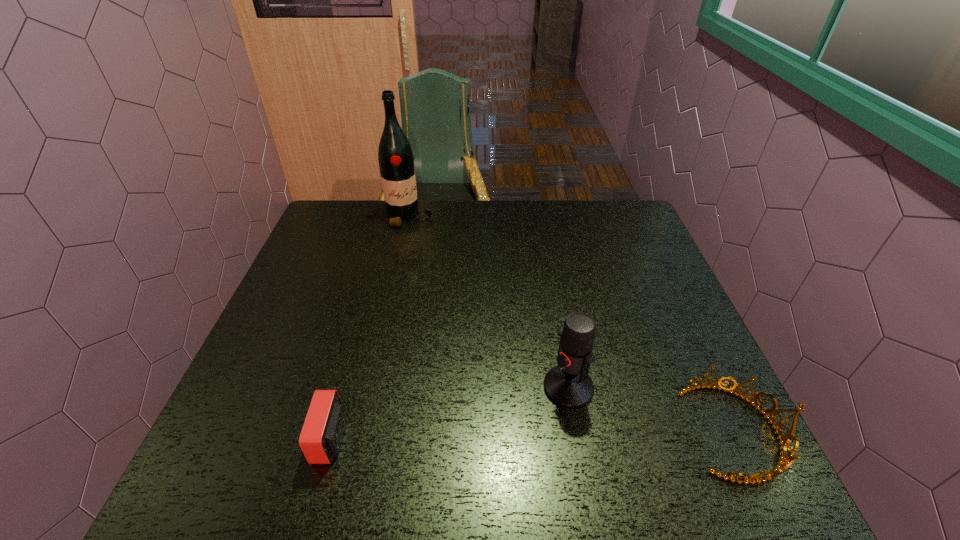
Identify the location of alarm clock. The image size is (960, 540). (321, 437).

Identify the location of the rightmost object. (784, 441).

Find the location of a particular element. The width and height of the screenshot is (960, 540). the tallest object is located at coordinates (395, 156).

Where is `wine bottle`? This screenshot has width=960, height=540. wine bottle is located at coordinates (395, 156).

Locate an element on the screen. This screenshot has width=960, height=540. microphone is located at coordinates (568, 385).

Locate an element on the screen. the third object from left to right is located at coordinates (568, 385).

You are a GUI agent. You are given a task and a screenshot of the screen. Output one action in this format:
    pyautogui.click(x=<x>, y=<y>)
    Task: Click on the vacant space situated on the front-facing side of the alarm clock
    The width and height of the screenshot is (960, 540).
    Given the screenshot: What is the action you would take?
    pyautogui.click(x=286, y=439)

What are the coordinates of `free space located 0.150m on the front-facing side of the alarm clock` in the screenshot? It's located at (240, 439).

In order to click on free space located 0.060m on the front-facing side of the alarm clock in this screenshot , I will do `click(286, 439)`.

Image resolution: width=960 pixels, height=540 pixels. Find the location of `vacant region located on the surface of the farthest object`. vacant region located on the surface of the farthest object is located at coordinates (432, 252).